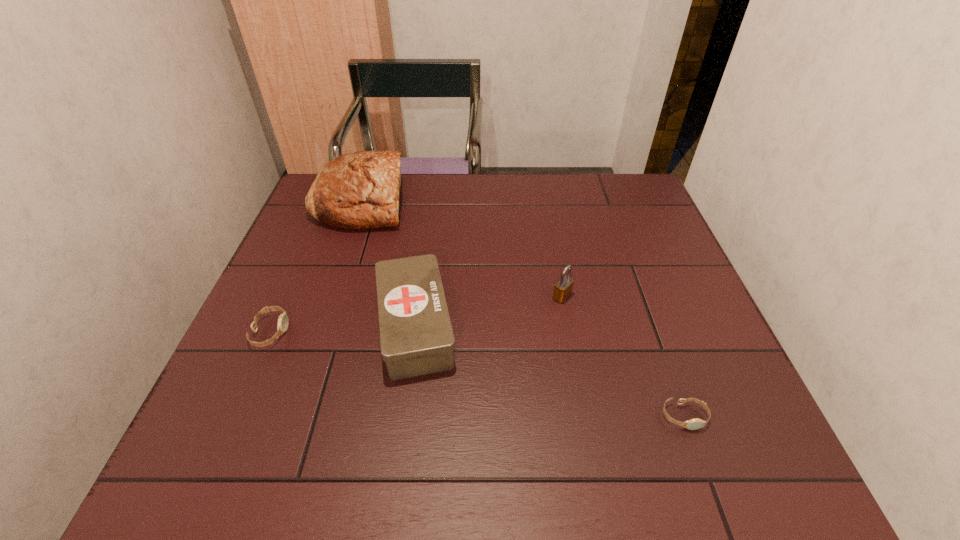
Where is `blank area located on the left of the first-aid kit`? This screenshot has width=960, height=540. blank area located on the left of the first-aid kit is located at coordinates (267, 326).

Where is `vacant region located on the face of the farther watch`? This screenshot has height=540, width=960. vacant region located on the face of the farther watch is located at coordinates (425, 332).

You are a GUI agent. You are given a task and a screenshot of the screen. Output one action in this format:
    pyautogui.click(x=<x>, y=<y>)
    Task: Click on the vacant region located 0.070m on the face of the shortest object
    The height and width of the screenshot is (540, 960).
    Given the screenshot: What is the action you would take?
    pyautogui.click(x=703, y=468)

This screenshot has width=960, height=540. Identify the location of object that is at the far edge. (360, 190).

Find the location of a particular element. The height and width of the screenshot is (540, 960). bread that is at the left edge is located at coordinates (360, 190).

The width and height of the screenshot is (960, 540). Find the location of `watch present at the left edge`. watch present at the left edge is located at coordinates (283, 321).

The width and height of the screenshot is (960, 540). In order to click on object that is at the right edge in this screenshot , I will do `click(693, 424)`.

Find the location of a particular element. object situated at the far left corner is located at coordinates (360, 190).

Identify the location of free region at the far edge. point(426,187).

The width and height of the screenshot is (960, 540). In the image, there is a desktop. Find the location of `free region at the near edge`. free region at the near edge is located at coordinates (357, 454).